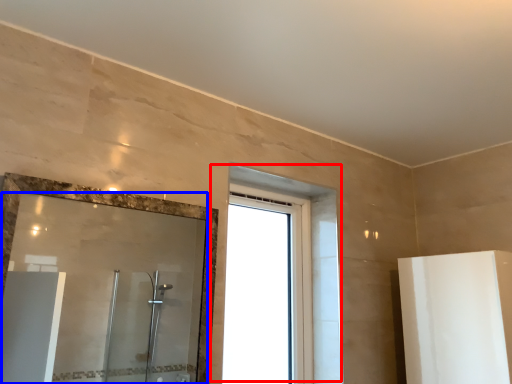
Question: Which of the following is the closest to the observer, window (highlighted by a red box) or mirror (highlighted by a blue box)?

Choices:
 (A) window
 (B) mirror

Answer: (B)